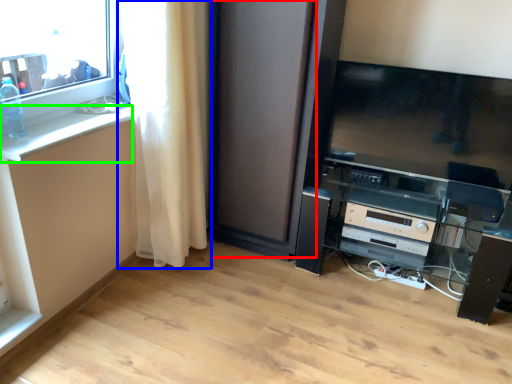
Question: Which object is positioned closest to screen door (highlighted by a red box)? Select from curtain (highlighted by a blue box) and counter top (highlighted by a green box).

Choices:
 (A) curtain
 (B) counter top

Answer: (A)